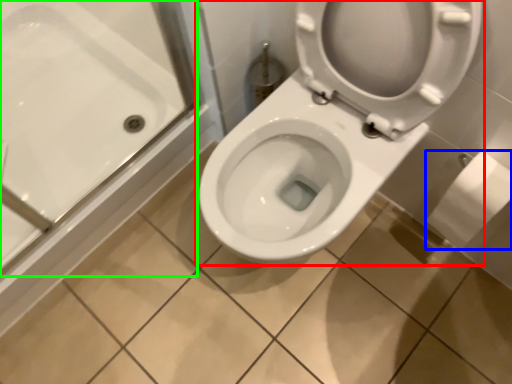
Question: Estimate the real-world distances between objects in this image. Which object is farther from toilet (highlighted by a red box), toilet paper (highlighted by a blue box) or bath (highlighted by a green box)?

Choices:
 (A) toilet paper
 (B) bath

Answer: (B)